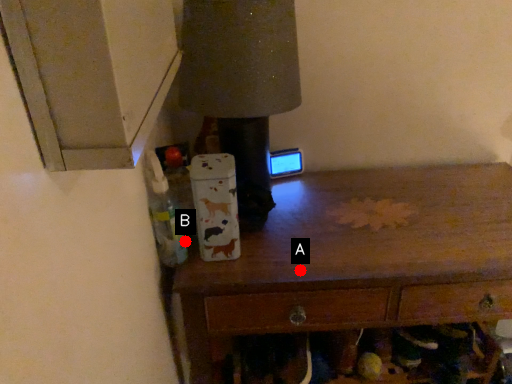
Question: Two points are circled on the image, labeled by A and B beside each circle. Which point is farther from the camera taking this photo?

Choices:
 (A) A is further
 (B) B is further

Answer: (B)